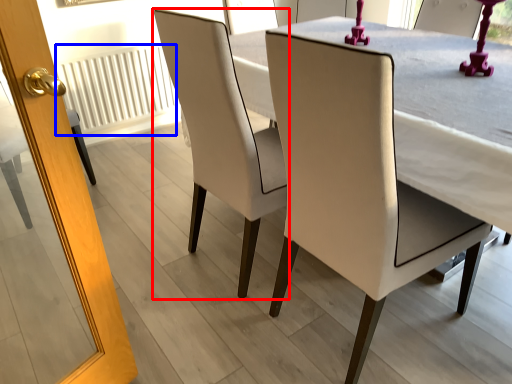
Question: Which of the following is the farthest to the observer, chair (highlighted by a red box) or radiator (highlighted by a blue box)?

Choices:
 (A) chair
 (B) radiator

Answer: (B)